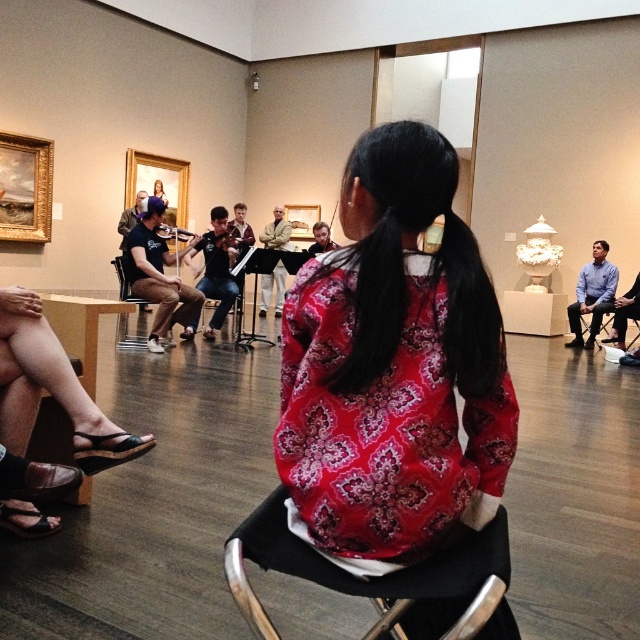
Question: Which object is the farthest from the black fabric chair at center?

Choices:
 (A) patterned fabric shirt at center
 (B) metallic silver chair at center

Answer: (B)

Question: Considering the relative positions of patterned fabric shirt at center and black fabric chair at center in the image provided, where is patterned fabric shirt at center located with respect to black fabric chair at center?

Choices:
 (A) above
 (B) below

Answer: (A)

Question: Does black fabric chair at center have a greater width compared to blue shirt at right?

Choices:
 (A) no
 (B) yes

Answer: (A)

Question: Does blue shirt at right appear under metallic silver chair at center?

Choices:
 (A) no
 (B) yes

Answer: (B)

Question: Which object is positioned closest to the black fabric chair at center?

Choices:
 (A) blue shirt at right
 (B) metallic silver chair at center

Answer: (B)

Question: Which point is closer to the camera?

Choices:
 (A) metallic silver chair at center
 (B) patterned fabric shirt at center
 (C) blue shirt at right

Answer: (B)